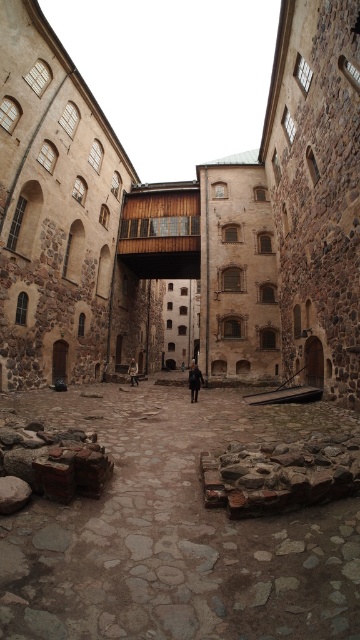
Between brown stone courtyard at center and dark brown leather coat at center, which one appears on the right side from the viewer's perspective?

From the viewer's perspective, brown stone courtyard at center appears more on the right side.

Is brown stone courtyard at center above dark brown leather coat at center?

Correct, brown stone courtyard at center is located above dark brown leather coat at center.

I want to click on brown stone courtyard at center, so click(182, 218).

Does brown stone courtyard at center appear on the left side of rustic stone courtyard at center?

No, brown stone courtyard at center is not to the left of rustic stone courtyard at center.

Is brown stone courtyard at center bigger than rustic stone courtyard at center?

Correct, brown stone courtyard at center is larger in size than rustic stone courtyard at center.

Describe the element at coordinates (182, 218) in the screenshot. Image resolution: width=360 pixels, height=640 pixels. I see `brown stone courtyard at center` at that location.

Find the location of a particular element. The image size is (360, 640). brown stone courtyard at center is located at coordinates (182, 218).

Does brown stone courtyard at center come behind brown leather jacket at center?

No, it is not.

Can you confirm if brown stone courtyard at center is thinner than brown leather jacket at center?

In fact, brown stone courtyard at center might be wider than brown leather jacket at center.

Image resolution: width=360 pixels, height=640 pixels. What do you see at coordinates (182, 218) in the screenshot?
I see `brown stone courtyard at center` at bounding box center [182, 218].

Image resolution: width=360 pixels, height=640 pixels. In order to click on brown stone courtyard at center in this screenshot , I will do `click(182, 218)`.